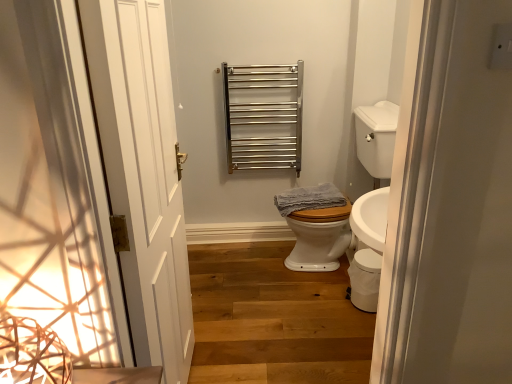
Question: Are white glossy sink at right and blue textured towel at center located far from each other?

Choices:
 (A) no
 (B) yes

Answer: (A)

Question: Is blue textured towel at center located within white glossy sink at right?

Choices:
 (A) no
 (B) yes

Answer: (B)

Question: Does white glossy sink at right have a larger size compared to blue textured towel at center?

Choices:
 (A) yes
 (B) no

Answer: (A)

Question: Is blue textured towel at center at the back of white glossy sink at right?

Choices:
 (A) no
 (B) yes

Answer: (B)

Question: Considering the relative sizes of white glossy sink at right and blue textured towel at center in the image provided, is white glossy sink at right wider than blue textured towel at center?

Choices:
 (A) no
 (B) yes

Answer: (B)

Question: From the image's perspective, is wooden stairs at center positioned above or below polished stainless steel towel rack at upper center?

Choices:
 (A) above
 (B) below

Answer: (B)

Question: Do you think wooden stairs at center is within polished stainless steel towel rack at upper center, or outside of it?

Choices:
 (A) inside
 (B) outside

Answer: (B)

Question: From a real-world perspective, is wooden stairs at center above or below polished stainless steel towel rack at upper center?

Choices:
 (A) above
 (B) below

Answer: (B)

Question: Looking at the image, does wooden stairs at center seem bigger or smaller compared to polished stainless steel towel rack at upper center?

Choices:
 (A) big
 (B) small

Answer: (A)

Question: From a real-world perspective, is blue textured towel at center physically located above or below white glossy sink at right?

Choices:
 (A) above
 (B) below

Answer: (B)

Question: Choose the correct answer: Is blue textured towel at center inside white glossy sink at right or outside it?

Choices:
 (A) outside
 (B) inside

Answer: (B)

Question: In terms of width, does blue textured towel at center look wider or thinner when compared to white glossy sink at right?

Choices:
 (A) wide
 (B) thin

Answer: (B)

Question: From the image's perspective, is blue textured towel at center positioned above or below white glossy sink at right?

Choices:
 (A) above
 (B) below

Answer: (B)

Question: From the image's perspective, is wooden stairs at center above or below white glossy toilet bowl at lower right?

Choices:
 (A) below
 (B) above

Answer: (A)

Question: Is point (318, 306) positioned closer to the camera than point (375, 286)?

Choices:
 (A) farther
 (B) closer

Answer: (A)